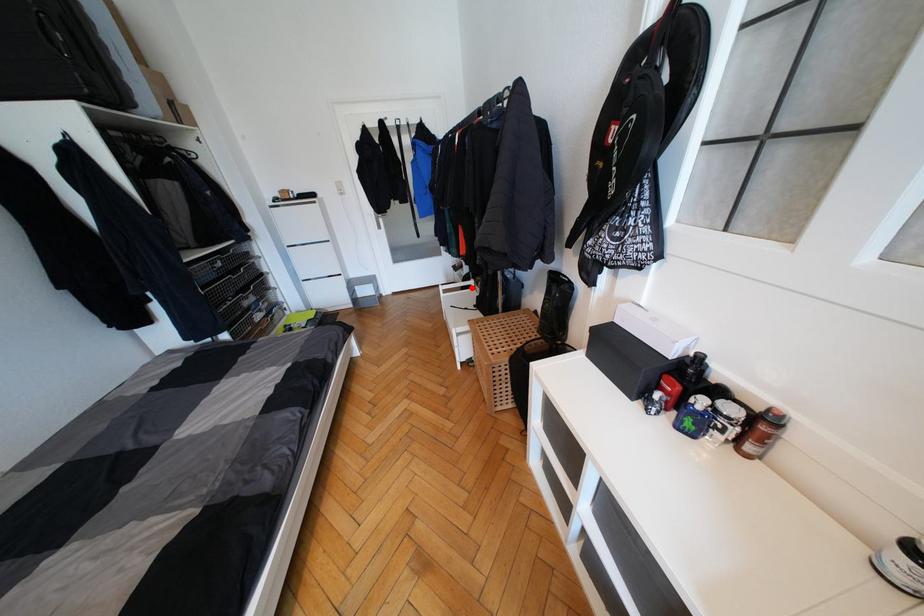
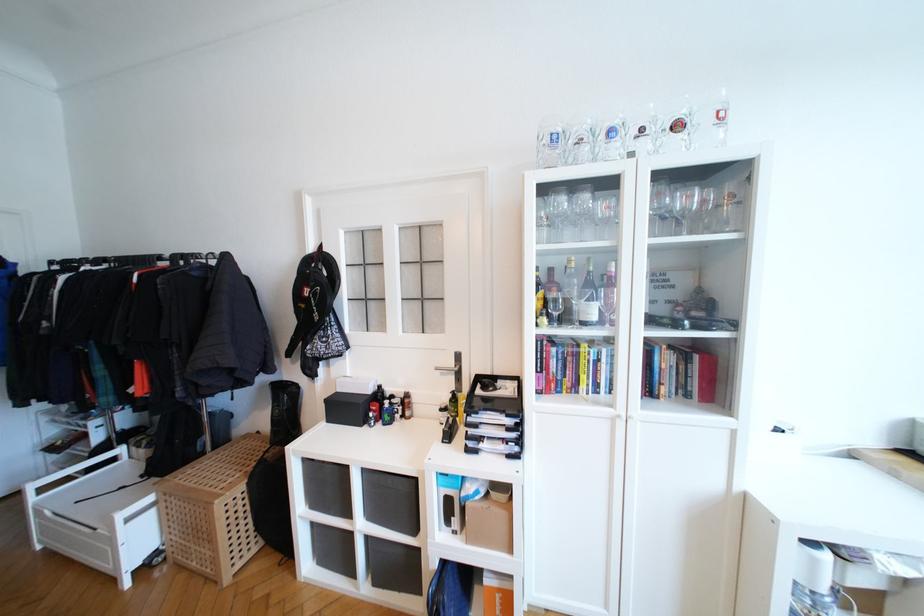
In the second image, find the point that corresponds to the highlighted location in the first image.

(116, 461)